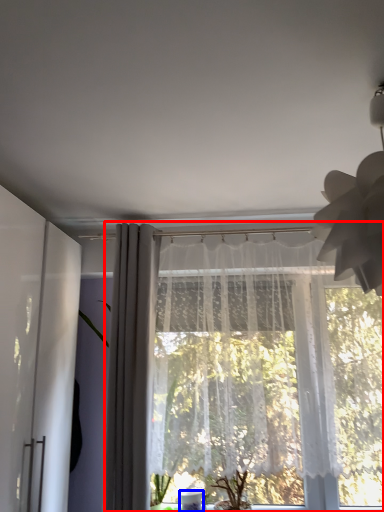
Question: Which object is closer to the camera taking this photo, curtain (highlighted by a red box) or glass vase (highlighted by a blue box)?

Choices:
 (A) curtain
 (B) glass vase

Answer: (A)